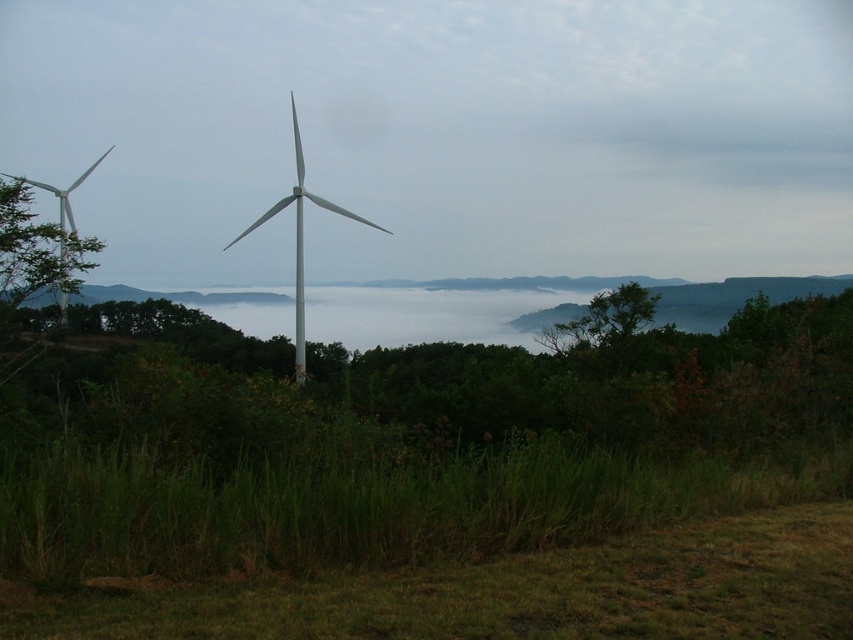
Can you confirm if white matte wind turbine at center is smaller than white matte windmill at left?

Correct, white matte wind turbine at center occupies less space than white matte windmill at left.

Can you confirm if white matte wind turbine at center is shorter than white matte windmill at left?

No.

Measure the distance between white matte wind turbine at center and camera.

white matte wind turbine at center and camera are 58.37 meters apart.

Find the location of a particular element. Image resolution: width=853 pixels, height=640 pixels. white matte wind turbine at center is located at coordinates (300, 241).